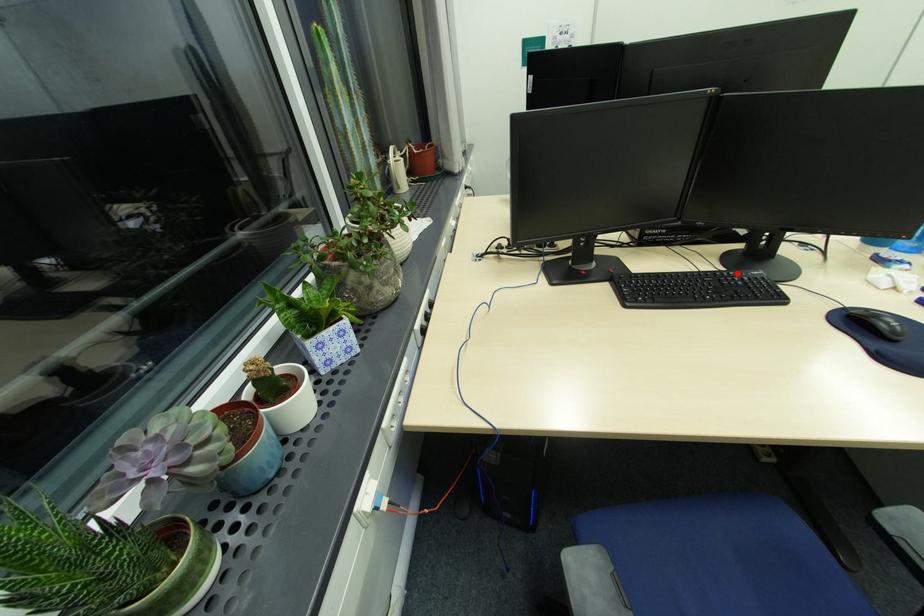
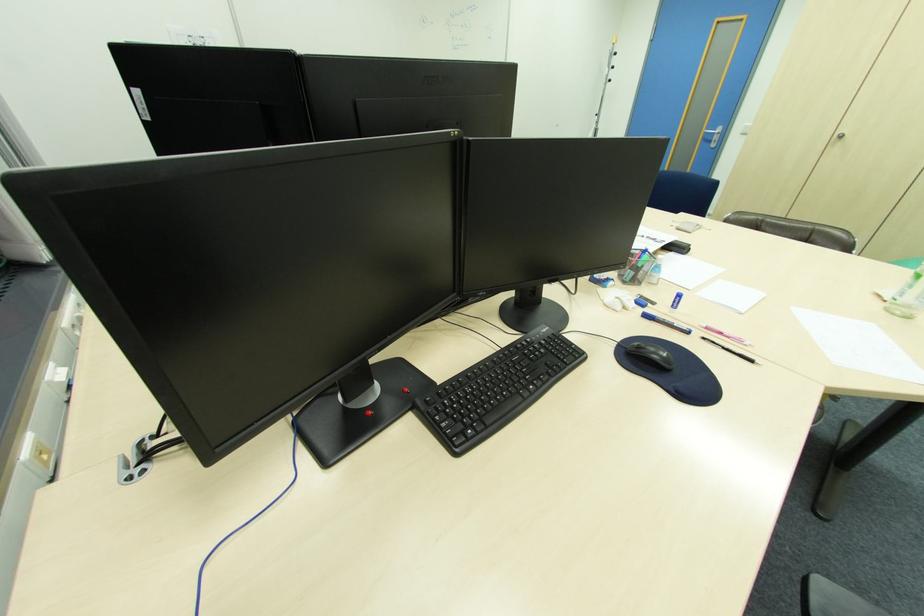
Where in the second image is the point corresponding to the highlighted location from the first image?

(533, 339)